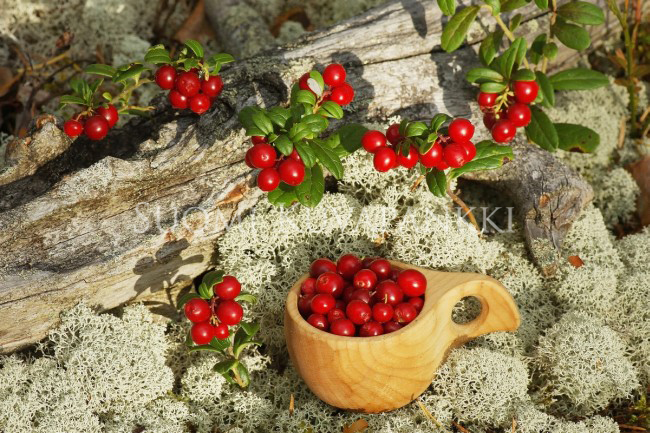
At what (x,y) coordinates should I click in order to perform the action: click on cup. Please return your answer as a coordinate pair (x, y). This screenshot has width=650, height=433. Looking at the image, I should click on (381, 374).